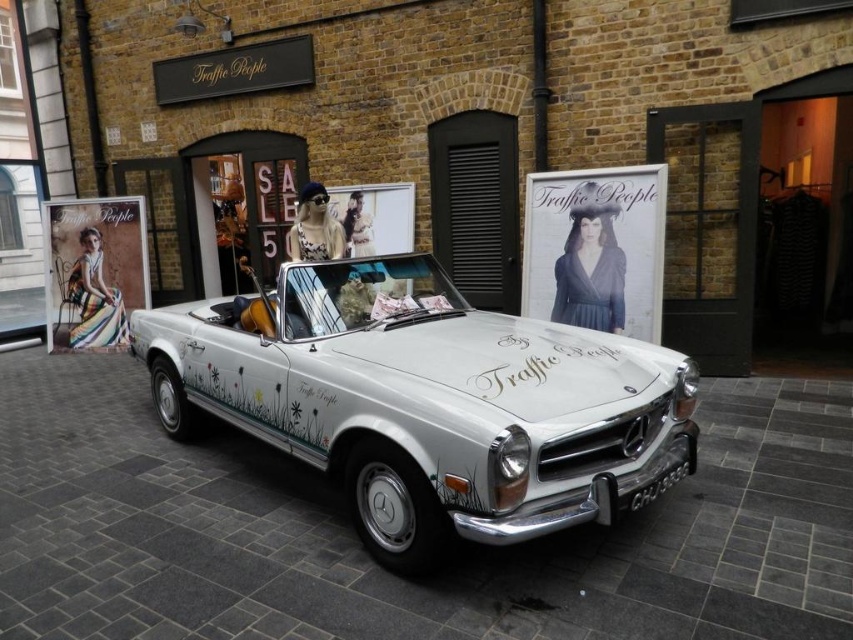
Question: Among these points, which one is farthest from the camera?

Choices:
 (A) (556, 234)
 (B) (680, 394)
 (C) (140, 244)
 (D) (664, 472)

Answer: (C)

Question: Does matte black poster at upper right have a greater width compared to multicolored fabric dress at left?

Choices:
 (A) yes
 (B) no

Answer: (B)

Question: Is multicolored fabric dress at left positioned at the back of black plastic license plate at center?

Choices:
 (A) no
 (B) yes

Answer: (B)

Question: Which object appears farthest from the camera in this image?

Choices:
 (A) matte black poster at upper right
 (B) white metallic car at center
 (C) black plastic license plate at center

Answer: (A)

Question: Does white metallic car at center appear on the right side of matte black poster at upper right?

Choices:
 (A) yes
 (B) no

Answer: (B)

Question: Which object appears closest to the camera in this image?

Choices:
 (A) matte black poster at upper right
 (B) multicolored fabric dress at left

Answer: (A)